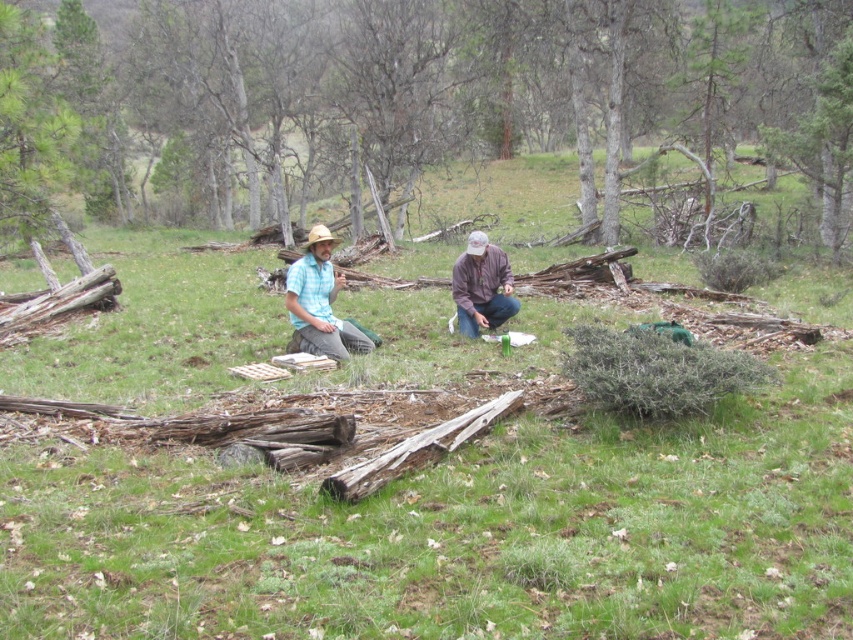
Is point (483, 320) farther from viewer compared to point (486, 269)?

That is False.

Does light blue cotton shirt at center have a lesser width compared to brown leather jacket at center?

No, light blue cotton shirt at center is not thinner than brown leather jacket at center.

Identify the location of light blue cotton shirt at center. This screenshot has height=640, width=853. (320, 304).

The height and width of the screenshot is (640, 853). Find the location of `light blue cotton shirt at center`. light blue cotton shirt at center is located at coordinates (320, 304).

Is point (335, 337) more distant than point (489, 314)?

No, it is in front of (489, 314).

Which is below, light blue plaid shirt at center or brown leather jacket at center?

light blue plaid shirt at center is lower down.

Who is more distant from viewer, (343, 280) or (502, 307)?

Point (343, 280)

Find the location of a particular element. The height and width of the screenshot is (640, 853). light blue plaid shirt at center is located at coordinates [x=320, y=304].

Who is positioned more to the left, light blue cotton shirt at center or light blue plaid shirt at center?

From the viewer's perspective, light blue plaid shirt at center appears more on the left side.

Is light blue cotton shirt at center closer to the viewer compared to light blue plaid shirt at center?

Yes, it is in front of light blue plaid shirt at center.

Where is `light blue cotton shirt at center`? The width and height of the screenshot is (853, 640). light blue cotton shirt at center is located at coordinates (320, 304).